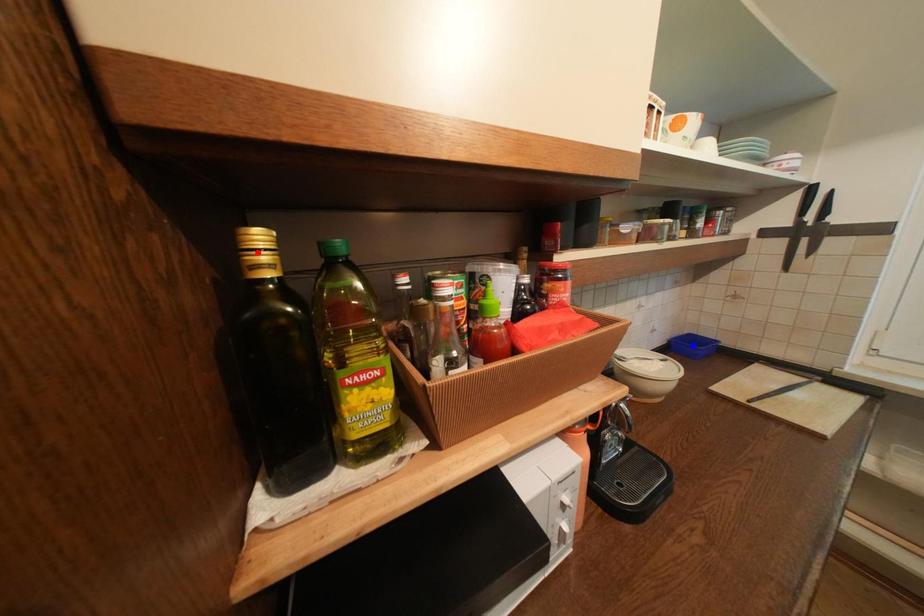
Question: Which of the two points in the image is closer to the camera?

Choices:
 (A) Blue point is closer.
 (B) Red point is closer.

Answer: (B)